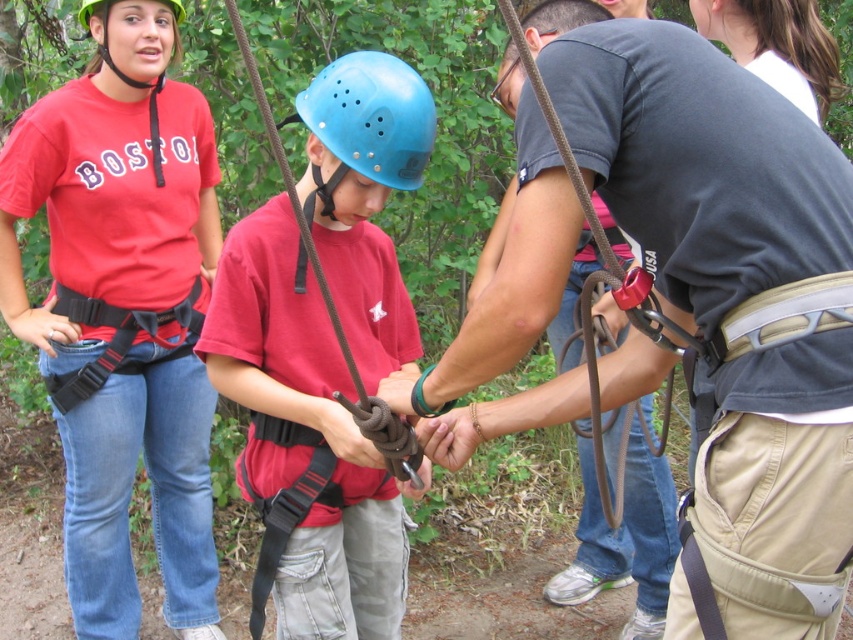
What color is the shirt of the person at the coordinates point (123, 312)?

The matte red shirt at center corresponds to the coordinates point (123, 312).

You are observing an outdoor ropes course activity. There is a matte red shirt at center and a dark gray fabric belt at center. Which object is positioned higher?

The matte red shirt at center is above the dark gray fabric belt at center, so the matte red shirt at center is positioned higher.

You are a safety inspector checking the setup of the ropes course. You notice two items in the image that need inspection. The first is the dark gray fabric belt at center, and the second is the matte green helmet at upper left. According to the safety guidelines, the belt should be positioned lower than the helmet to ensure proper harness alignment. Does the current setup comply with this requirement?

The dark gray fabric belt at center is much taller than the matte green helmet at upper left, so the current setup does not comply with the safety guidelines because the belt is positioned higher than the helmet instead of lower.